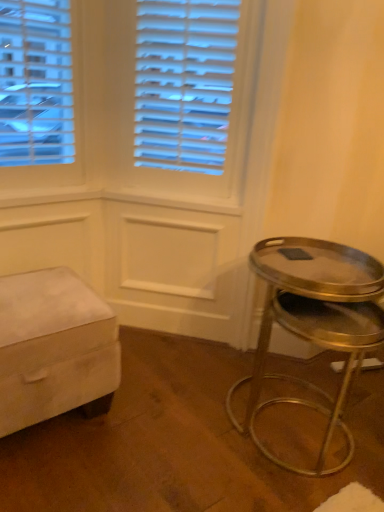
Question: In the image, is gold metallic stool at right positioned in front of or behind velvet beige ottoman at lower left?

Choices:
 (A) behind
 (B) front

Answer: (B)

Question: In terms of width, does gold metallic stool at right look wider or thinner when compared to velvet beige ottoman at lower left?

Choices:
 (A) thin
 (B) wide

Answer: (A)

Question: Visually, is gold metallic stool at right positioned to the left or to the right of velvet beige ottoman at lower left?

Choices:
 (A) left
 (B) right

Answer: (B)

Question: From the image's perspective, is velvet beige ottoman at lower left located above or below gold metallic stool at right?

Choices:
 (A) below
 (B) above

Answer: (B)

Question: From a real-world perspective, is velvet beige ottoman at lower left positioned above or below gold metallic stool at right?

Choices:
 (A) below
 (B) above

Answer: (A)

Question: Is velvet beige ottoman at lower left to the left or to the right of gold metallic stool at right in the image?

Choices:
 (A) right
 (B) left

Answer: (B)

Question: In terms of width, does velvet beige ottoman at lower left look wider or thinner when compared to gold metallic stool at right?

Choices:
 (A) wide
 (B) thin

Answer: (A)